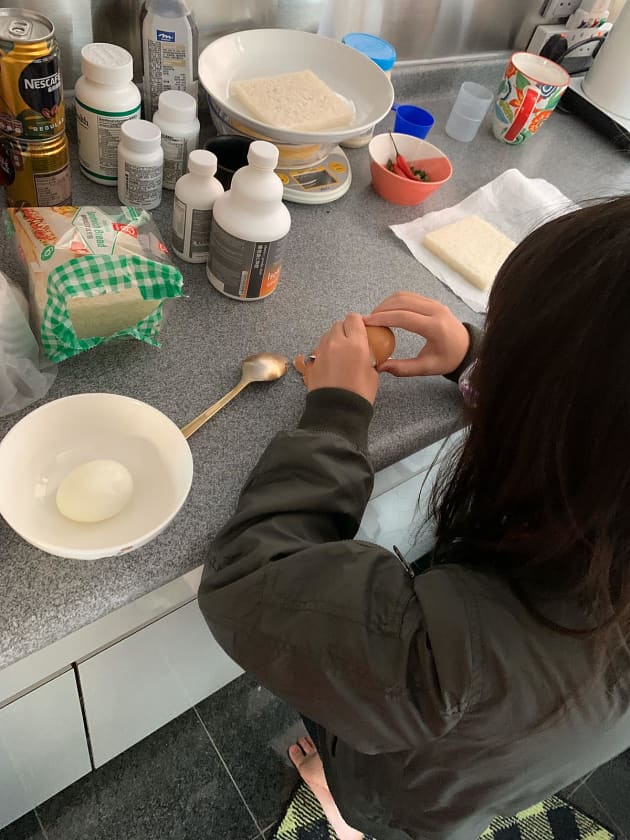
Identify the location of spoon. (265, 360).